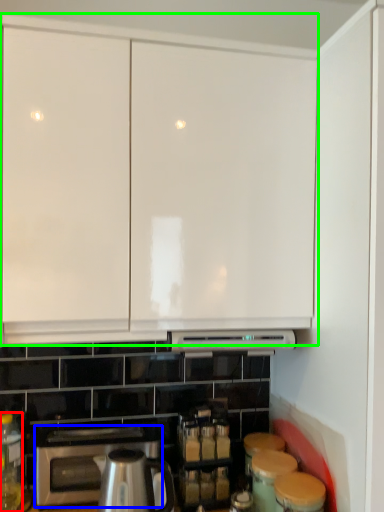
Question: Which object is positioned farthest from bottle (highlighted by a red box)? Select from home appliance (highlighted by a blue box) and cabinetry (highlighted by a green box).

Choices:
 (A) home appliance
 (B) cabinetry

Answer: (B)